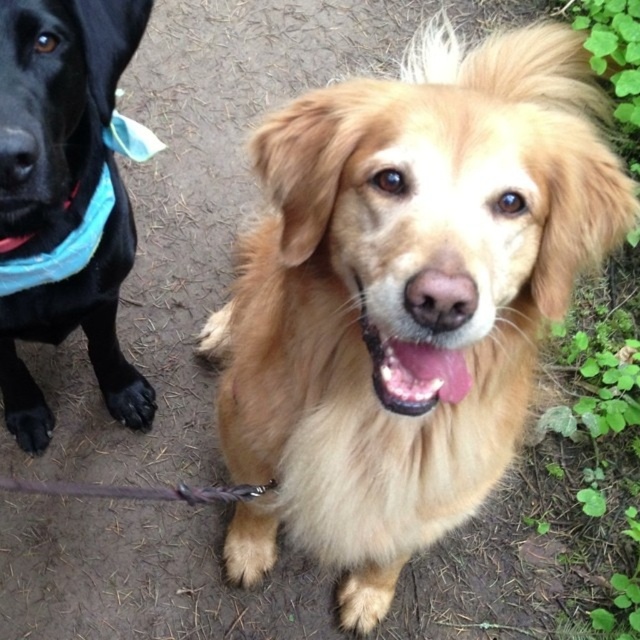
Question: Where is golden fluffy dog at center located in relation to shiny black dog at left in the image?

Choices:
 (A) above
 (B) below

Answer: (A)

Question: Which point is closer to the camera taking this photo?

Choices:
 (A) (35, 284)
 (B) (513, 227)

Answer: (B)

Question: Which point is farther to the camera?

Choices:
 (A) blue fabric neckband at left
 (B) golden fluffy dog at center

Answer: (A)

Question: Which object is closer to the camera taking this photo?

Choices:
 (A) shiny black dog at left
 (B) blue fabric neckband at left
 (C) golden fluffy dog at center

Answer: (C)

Question: Is golden fluffy dog at center thinner than shiny black dog at left?

Choices:
 (A) no
 (B) yes

Answer: (A)

Question: Is golden fluffy dog at center wider than blue fabric neckband at left?

Choices:
 (A) no
 (B) yes

Answer: (B)